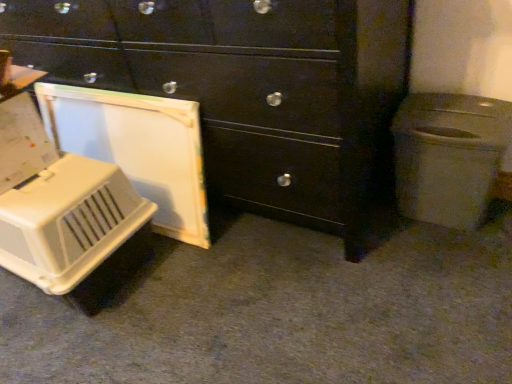
The image size is (512, 384). I want to click on vacant area that is in front of white plastic trash can at right, so [x=459, y=255].